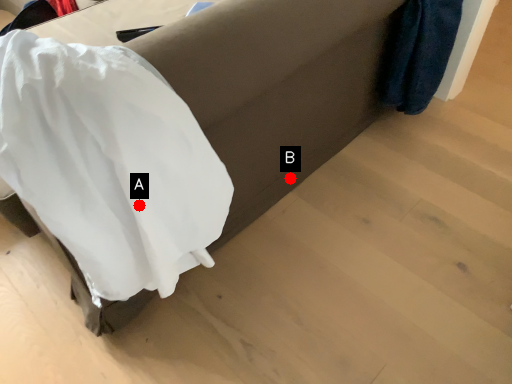
Question: Two points are circled on the image, labeled by A and B beside each circle. Which of the following is the closest to the observer?

Choices:
 (A) A is closer
 (B) B is closer

Answer: (A)